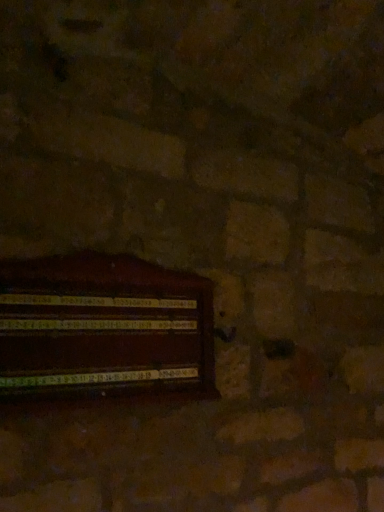
At what (x,y) coordinates should I click in order to perform the action: click on wooden chest at left. Please return your answer as a coordinate pair (x, y). Looking at the image, I should click on (103, 326).

Describe the element at coordinates (103, 326) in the screenshot. I see `wooden chest at left` at that location.

Identify the location of wooden chest at left. The image size is (384, 512). (103, 326).